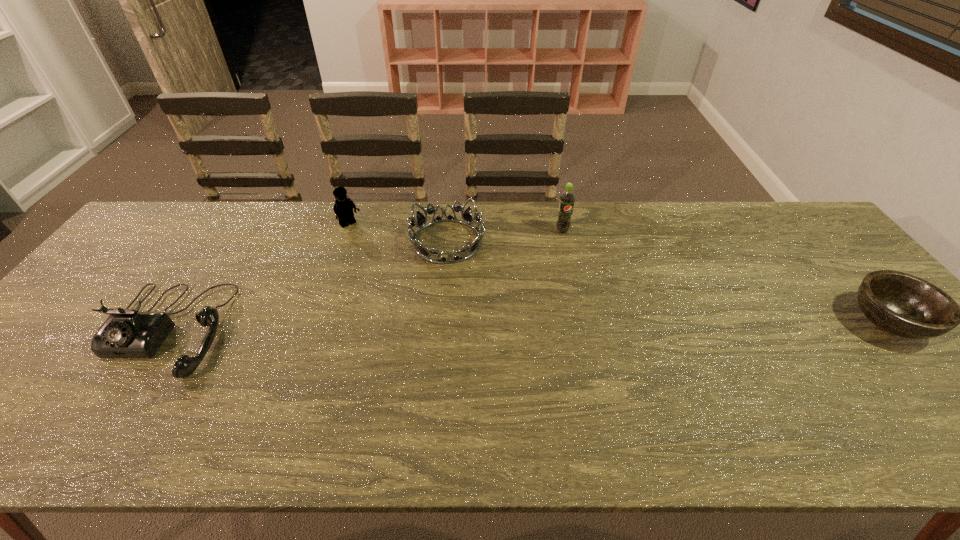
Locate an element on the screen. This screenshot has width=960, height=540. the leftmost object is located at coordinates (127, 333).

Find the location of `bowl`. bowl is located at coordinates (904, 305).

I want to click on tiara, so click(x=424, y=252).

You are a GUI agent. You are given a task and a screenshot of the screen. Output one action in this format:
    pyautogui.click(x=<x>, y=<y>)
    Task: Click on the tallest object
    The image size is (960, 540).
    Given the screenshot: What is the action you would take?
    pyautogui.click(x=567, y=198)

Where is `soda`? The width and height of the screenshot is (960, 540). soda is located at coordinates (567, 198).

You are a GUI agent. You are given a task and a screenshot of the screen. Output one action in this format:
    pyautogui.click(x=<x>, y=<y>)
    Task: Click on the fourth object from right to left
    This screenshot has height=540, width=960.
    Given the screenshot: What is the action you would take?
    pyautogui.click(x=343, y=208)

Locate an element on the screen. This screenshot has width=960, height=540. vacant point located 0.400m on the left of the bowl is located at coordinates (693, 322).

The width and height of the screenshot is (960, 540). Identify the location of free space located on the front-facing side of the third object from left to right. (545, 289).

Find the location of a particular element. This screenshot has width=960, height=540. free space located 0.220m on the front-facing side of the third object from left to right is located at coordinates (542, 288).

Identify the location of vacant space located 0.130m on the front-facing side of the third object from left to right. This screenshot has width=960, height=540. (515, 275).